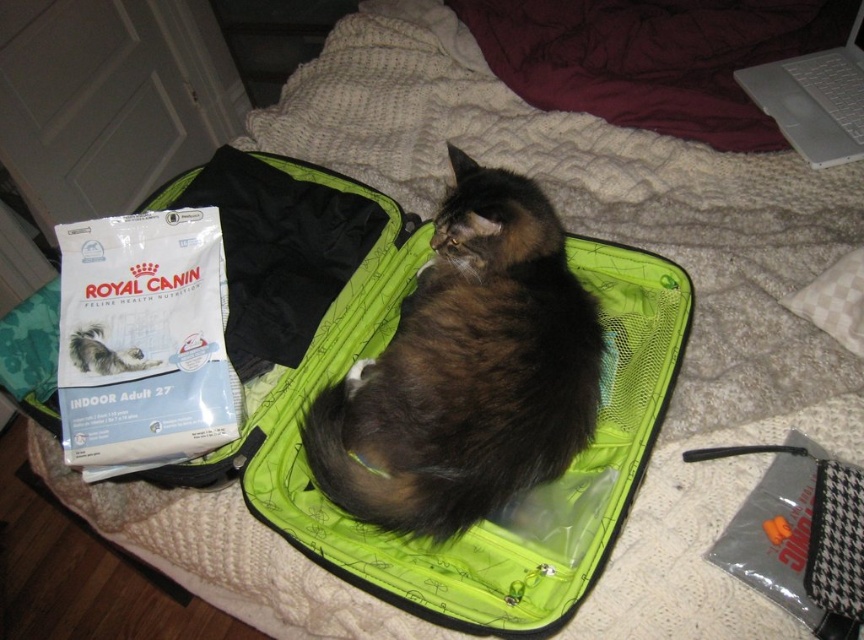
You are trying to decide whether to place the brown fluffy cat at center on top of the white plastic laptop at upper right. Based on their sizes, do you think the cat will fit without falling off?

The brown fluffy cat at center is much taller than the white plastic laptop at upper right. Therefore, placing the cat on top would likely cause it to fall off since it is significantly larger in height.

You are taking a photo of the cat inside the green backpack. Which point, point (461,205) or point (843,42), is closer to the camera?

Point (461,205) is closer to the camera than point (843,42).

You are organizing a space for a cat. You have a brown fluffy cat at center and a white plastic laptop at upper right. Which object takes up more space in the scene?

The brown fluffy cat at center is larger in size than the white plastic laptop at upper right, so it takes up more space in the scene.